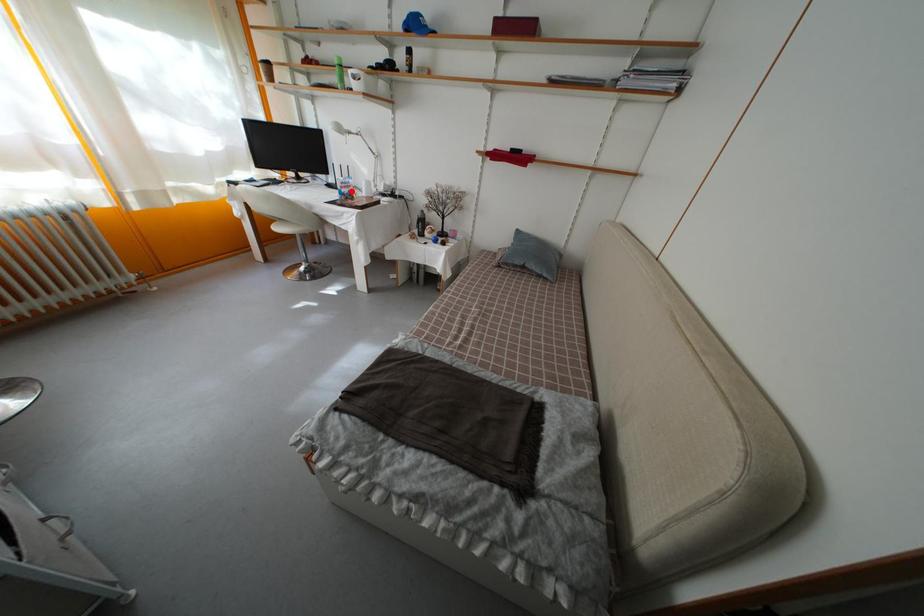
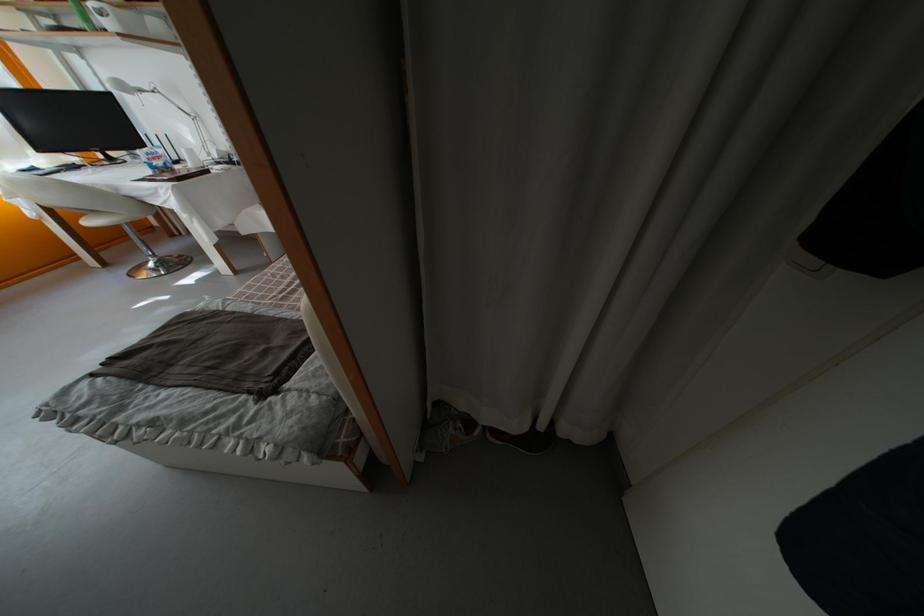
Where in the second image is the point corresponding to the highlighted location from the first image?

(160, 161)